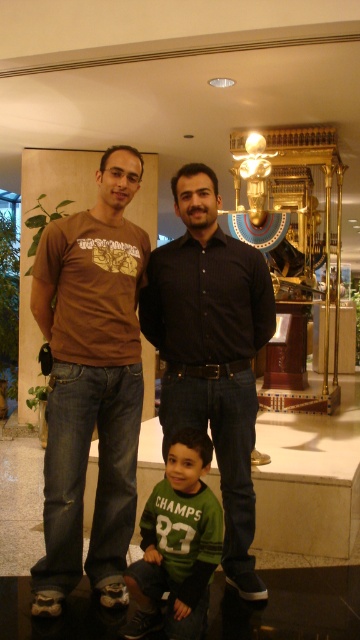
You are a photographer positioned in front of the golden statue. You need to capture a photo of both the black matte shirt at center and the green jersey at center. Which one should you focus on first to ensure both are in frame?

The black matte shirt at center has a greater height compared to the green jersey at center, so you should focus on the black matte shirt at center first to ensure both are in frame.